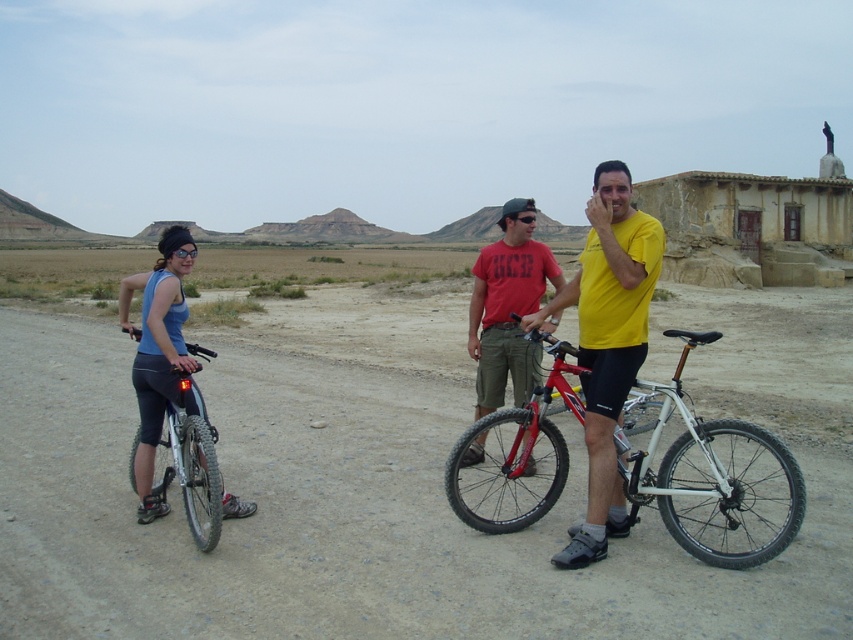
Is white matte bicycle at center thinner than matte black bicycle at left?

No.

Is white matte bicycle at center further to camera compared to matte black bicycle at left?

No, it is not.

At what (x,y) coordinates should I click in order to perform the action: click on white matte bicycle at center. Please return your answer as a coordinate pair (x, y). Image resolution: width=853 pixels, height=640 pixels. Looking at the image, I should click on (718, 486).

Who is lower down, red matte shirt at center or matte black bicycle at left?

matte black bicycle at left

Does red matte shirt at center have a lesser height compared to matte black bicycle at left?

In fact, red matte shirt at center may be taller than matte black bicycle at left.

Is point (503, 349) farther from camera compared to point (210, 508)?

Yes, point (503, 349) is farther from viewer.

Find the location of a particular element. This screenshot has width=853, height=640. red matte shirt at center is located at coordinates (508, 307).

Which of these two, dirt track at center or matte black bicycle at left, stands shorter?

Standing shorter between the two is matte black bicycle at left.

This screenshot has width=853, height=640. Identify the location of dirt track at center. (392, 484).